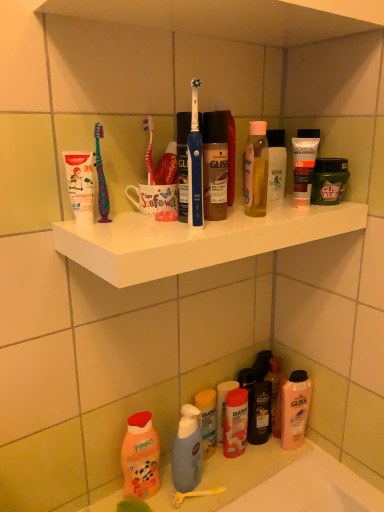
Question: Does point (309, 195) appear closer or farther from the camera than point (221, 399)?

Choices:
 (A) closer
 (B) farther

Answer: (A)

Question: Which is correct: matte black tube at upper right, acting as the 1th toiletry starting from the top, is inside translucent plastic bottle at lower center, which is the 4th toiletry from right to left, or outside of it?

Choices:
 (A) inside
 (B) outside

Answer: (B)

Question: Which of these objects is positioned closest to the white matte shelf at upper center?

Choices:
 (A) matte orange lotion at lower center, which is the fifth toiletry from top to bottom
 (B) white matte toothpaste tube at upper left, positioned as the third toiletry in top-to-bottom order
 (C) translucent plastic bottle at lower center, the 3th toiletry when ordered from bottom to top
 (D) translucent plastic pump bottle at lower center, acting as the fifth toiletry starting from the right
 (E) translucent plastic bottles at lower center

Answer: (B)

Question: Considering the real-world distances, which object is farthest from the pink matte shampoo at lower right, which ranks as the 2th cleaning product in front-to-back order?

Choices:
 (A) blue plastic toothbrush at center
 (B) matte orange lotion at lower center, the second toiletry in the bottom-to-top sequence
 (C) white matte shelf at upper center
 (D) translucent plastic bottles at lower center
 (E) green matte hair mask at upper right, which appears as the 2th toiletry when viewed from the top

Answer: (A)